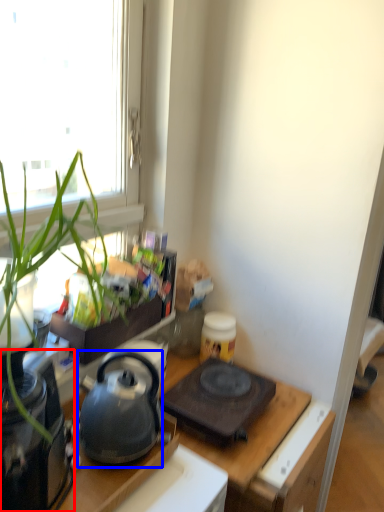
Question: Which of the following is the farthest to the observer, appliance (highlighted by a red box) or kettle (highlighted by a blue box)?

Choices:
 (A) appliance
 (B) kettle

Answer: (B)